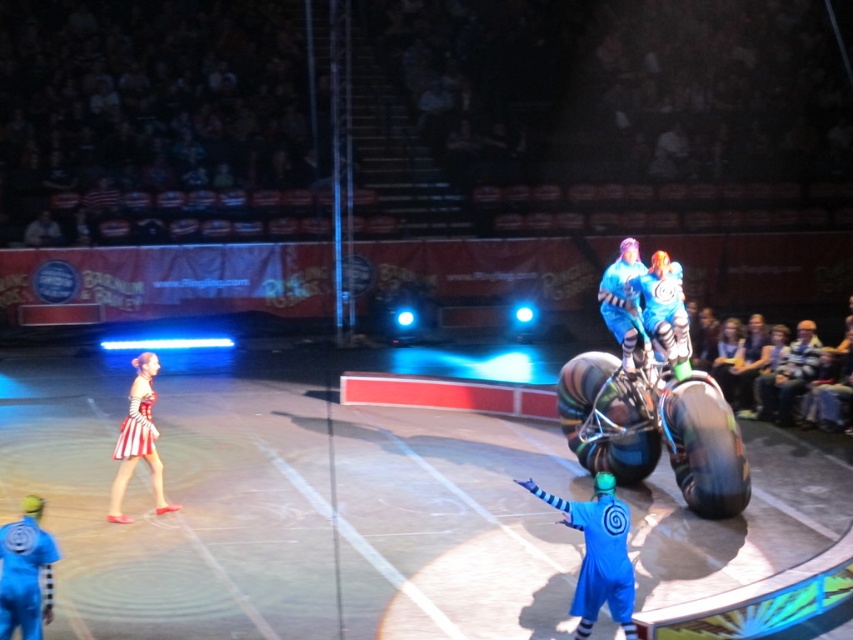
Can you confirm if blue fabric at center is positioned to the left of striped fabric dress at left?

In fact, blue fabric at center is to the right of striped fabric dress at left.

In order to click on blue fabric at center in this screenshot , I will do `click(598, 554)`.

Which is behind, point (573, 611) or point (138, 394)?

Point (138, 394)

I want to click on blue fabric at center, so click(x=598, y=554).

Does blue fabric at center have a lesser width compared to blue shiny helmet at upper center?

In fact, blue fabric at center might be wider than blue shiny helmet at upper center.

Consider the image. Is blue fabric at center to the right of blue shiny helmet at upper center from the viewer's perspective?

In fact, blue fabric at center is to the left of blue shiny helmet at upper center.

The image size is (853, 640). I want to click on blue fabric at center, so click(x=598, y=554).

Who is taller, blue fabric at center or blue fabric jacket at right?

Standing taller between the two is blue fabric jacket at right.

Is blue fabric at center bigger than blue fabric jacket at right?

No, blue fabric at center is not bigger than blue fabric jacket at right.

Is point (605, 589) behind point (842, 368)?

No, it is in front of (842, 368).

Find the location of `blue fabric at center`. blue fabric at center is located at coordinates (598, 554).